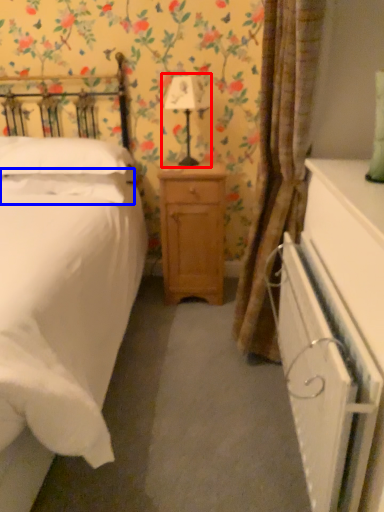
Question: Which object is closer to the camera taking this photo, bedside lamp (highlighted by a red box) or pillow (highlighted by a blue box)?

Choices:
 (A) bedside lamp
 (B) pillow

Answer: (A)